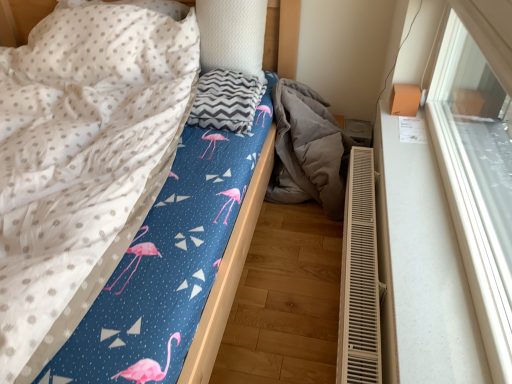
Question: In the image, is gray chevron blanket at center positioned in front of or behind blue fabric bed at center?

Choices:
 (A) front
 (B) behind

Answer: (B)

Question: Is point (200, 92) closer or farther from the camera than point (284, 19)?

Choices:
 (A) farther
 (B) closer

Answer: (B)

Question: Which of these objects is positioned farthest from the gray fabric at lower right?

Choices:
 (A) white glossy window sill at upper right
 (B) white textured pillow at upper center
 (C) gray chevron blanket at center
 (D) white plastic radiator at lower right
 (E) blue fabric bed at center

Answer: (A)

Question: Estimate the real-world distances between objects in this image. Which object is closer to the gray fabric at lower right?

Choices:
 (A) blue fabric bed at center
 (B) white glossy window sill at upper right
 (C) white plastic radiator at lower right
 (D) white textured pillow at upper center
 (E) gray chevron blanket at center

Answer: (C)